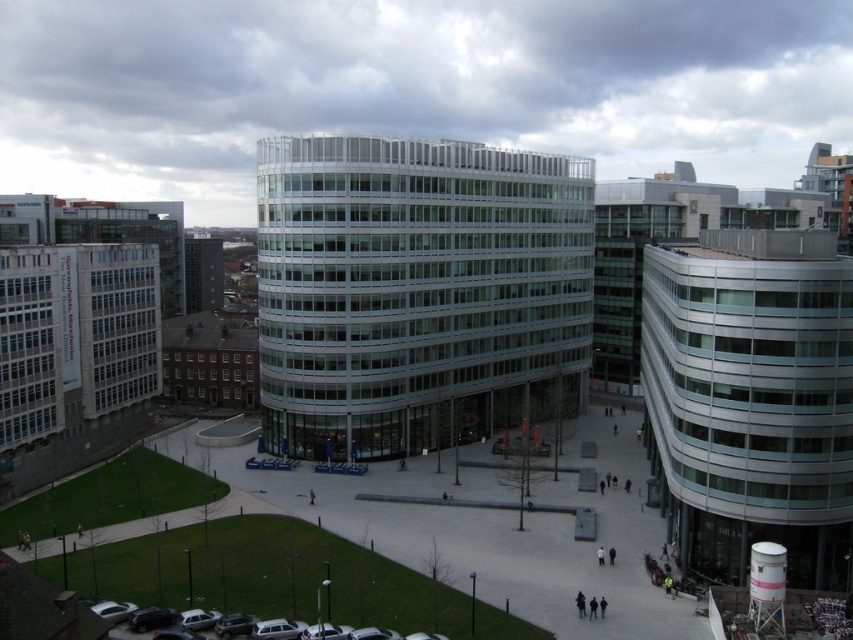
The image size is (853, 640). Find the location of `glassy metallic building at center`. glassy metallic building at center is located at coordinates (418, 291).

You are a GUI agent. You are given a task and a screenshot of the screen. Output one action in this format:
    pyautogui.click(x=<x>, y=<y>)
    Task: Click on the glassy metallic building at center
    The height and width of the screenshot is (640, 853).
    Given the screenshot: What is the action you would take?
    pyautogui.click(x=418, y=291)